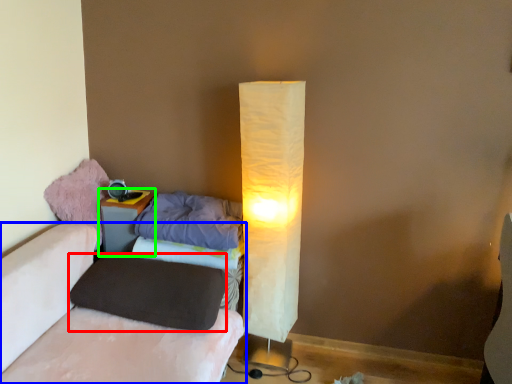
Question: Based on their relative distances, which object is nearer to pillow (highlighted by a red box)? Choose from furniture (highlighted by a blue box) and nightstand (highlighted by a green box).

Choices:
 (A) furniture
 (B) nightstand

Answer: (A)